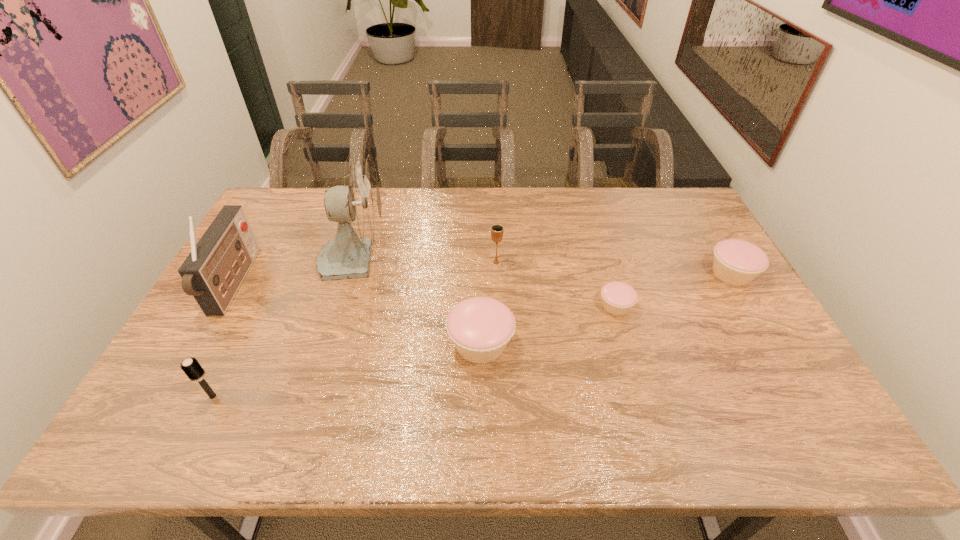
Considering the uniform spacing of cupcakes, where should an additional cupcake be positioned on the left? Please locate a free spot. Please provide its 2D coordinates. Your answer should be formatted as a tuple, i.e. [(x, y)], where the tuple contains the x and y coordinates of a point satisfying the conditions above.

[(322, 389)]